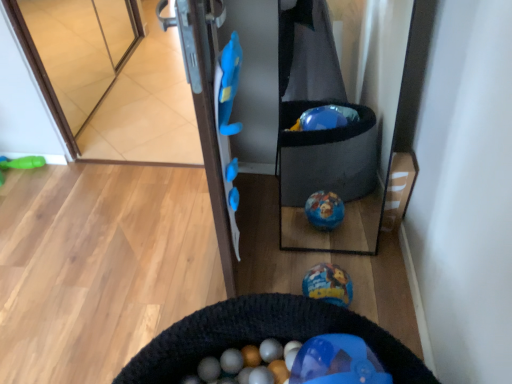
Question: Considering the relative positions of black knitted cat bed at lower center and transparent glass door at upper left in the image provided, is black knitted cat bed at lower center to the right of transparent glass door at upper left from the viewer's perspective?

Choices:
 (A) yes
 (B) no

Answer: (A)

Question: Is transparent glass door at upper left located within black knitted cat bed at lower center?

Choices:
 (A) yes
 (B) no

Answer: (B)

Question: Is black knitted cat bed at lower center directly adjacent to transparent glass door at upper left?

Choices:
 (A) no
 (B) yes

Answer: (A)

Question: Considering the relative sizes of black knitted cat bed at lower center and transparent glass door at upper left in the image provided, is black knitted cat bed at lower center bigger than transparent glass door at upper left?

Choices:
 (A) no
 (B) yes

Answer: (B)

Question: Can you confirm if black knitted cat bed at lower center is thinner than transparent glass door at upper left?

Choices:
 (A) yes
 (B) no

Answer: (B)

Question: Do you think transparent glass door at upper left is within green rubber toy at left, marked as the 2th toy in a front-to-back arrangement, or outside of it?

Choices:
 (A) outside
 (B) inside

Answer: (A)

Question: Is transparent glass door at upper left to the left or to the right of green rubber toy at left, which ranks as the 2th toy in right-to-left order, in the image?

Choices:
 (A) right
 (B) left

Answer: (A)

Question: Considering the positions of point (120, 31) and point (30, 162), is point (120, 31) closer or farther from the camera than point (30, 162)?

Choices:
 (A) closer
 (B) farther

Answer: (B)

Question: From the image's perspective, is transparent glass door at upper left positioned above or below green rubber toy at left, marked as the 2th toy in a front-to-back arrangement?

Choices:
 (A) above
 (B) below

Answer: (A)

Question: Does point (321, 286) appear closer or farther from the camera than point (286, 329)?

Choices:
 (A) farther
 (B) closer

Answer: (A)

Question: In the image, is shiny metallic ball at center, which is the first toy from bottom to top, positioned in front of or behind black knitted cat bed at lower center?

Choices:
 (A) behind
 (B) front

Answer: (A)

Question: Is shiny metallic ball at center, the 2th toy viewed from the left, wider or thinner than black knitted cat bed at lower center?

Choices:
 (A) wide
 (B) thin

Answer: (B)

Question: Based on their sizes in the image, would you say shiny metallic ball at center, which is the first toy from bottom to top, is bigger or smaller than black knitted cat bed at lower center?

Choices:
 (A) big
 (B) small

Answer: (B)

Question: Is transparent glass door at upper left spatially inside black knitted cat bed at lower center, or outside of it?

Choices:
 (A) outside
 (B) inside

Answer: (A)

Question: Based on their sizes in the image, would you say transparent glass door at upper left is bigger or smaller than black knitted cat bed at lower center?

Choices:
 (A) small
 (B) big

Answer: (A)